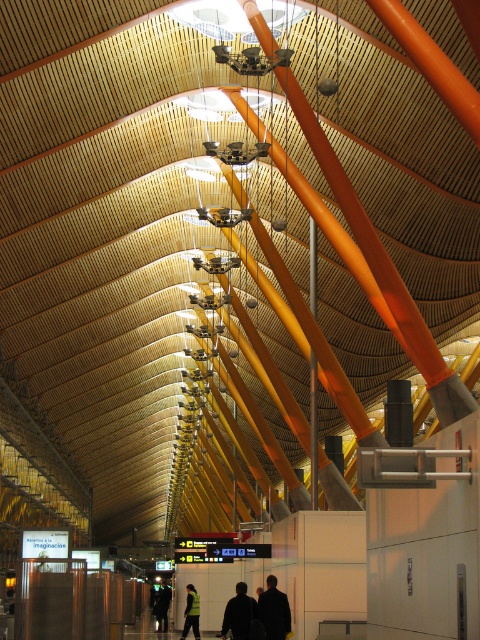
You are an interior designer assessing the space. You need to hang a decorative banner that is 1.2 meters wide between the orange glossy beam at upper center and the dark fabric jacket at center. Based on their widths, will the banner fit without overlapping either object?

The orange glossy beam at upper center is wider than the dark fabric jacket at center. Since the banner is 1.2 meters wide, it can be placed between them as long as the distance between the two objects allows for the banner width. However, the question only provides information about their widths, not the distance between them. Therefore, the banner might fit, but further spatial measurements are needed to confirm.

You are a traveler who just arrived at the airport and is looking for your jacket. You remember that your jacket is the larger one between the dark brown leather jacket at center and the dark green jacket at center. Which jacket should you choose?

The dark green jacket at center is larger than the dark brown leather jacket at center, so you should choose the dark green jacket at center.

You are standing at the entrance of the terminal and see two jackets hanging on separate hooks at the center of the room. The dark fabric jacket at center and the dark green jacket at center. You want to retrieve both jackets but can only reach items within 25 meters. Can you reach both jackets?

The dark fabric jacket at center is 24.41 meters away from the dark green jacket at center. Since both jackets are at the center of the room and you are at the entrance, your distance to each jacket would depend on the room dimensions. However, the maximum distance between the two jackets is 24.41 meters. If you are at the entrance, it is possible that both jackets are within your 25 meter reach. However, without knowing the exact position of the entrance relative to the center, it is uncertain. Please move